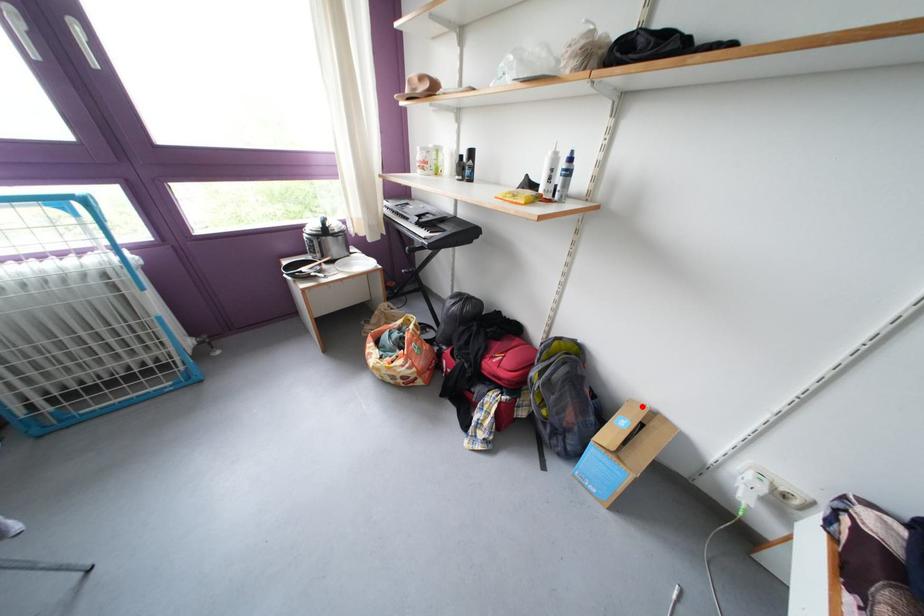
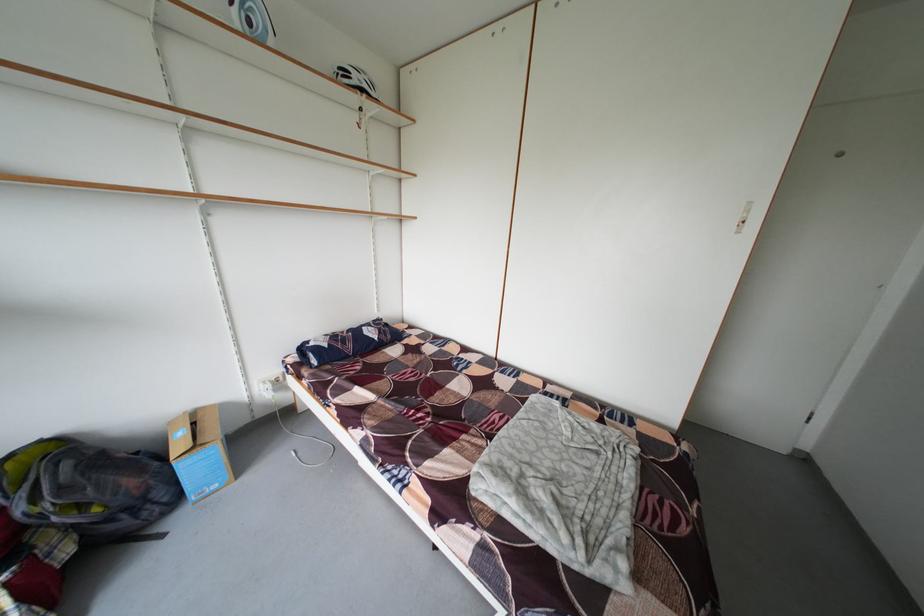
Question: I am providing you with two images of the same scene from different viewpoints. Given a red point in image1, look at the same physical point in image2. Is it:

Choices:
 (A) Closer to the viewpoint
 (B) Farther from the viewpoint

Answer: (B)